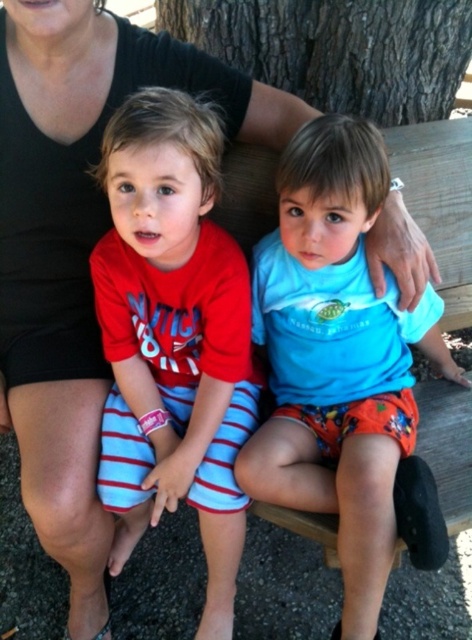
You are a photographer standing 1.5 meters away from the camera position. You want to take a photo of the blue matte shirt at center. Can you reach it with your 1.2 meter long extendable pole?

The blue matte shirt at center is 1.06 meters away from the camera. Since you are standing 1.5 meters away from the camera position, your total distance to the blue matte shirt at center would be 1.5 meters minus 1.06 meters, which equals 0.44 meters. Your extendable pole is 1.2 meters long, so yes, you can easily reach the blue matte shirt at center with the pole.

You are a photographer taking a picture of the children in the park. You want to focus on the red striped shorts at center and the blue matte shirt at center. Which one should you adjust your camera focus to first to ensure both are in focus?

You should focus on the red striped shorts at center first since it is closer to the viewer than the blue matte shirt at center, allowing the camera to adjust depth of field to include both.

You are a photographer standing at the camera position. You want to focus on the two points in the image. Which point is closer to you, point [114,131] or point [334,83]?

Point [114,131] is in front of point [334,83], so it is closer to you.